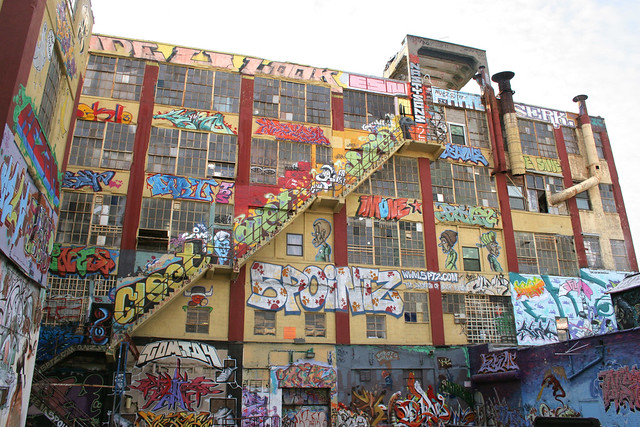
The image size is (640, 427). What are the coordinates of `1 row of stairs` in the screenshot? It's located at (57, 406).